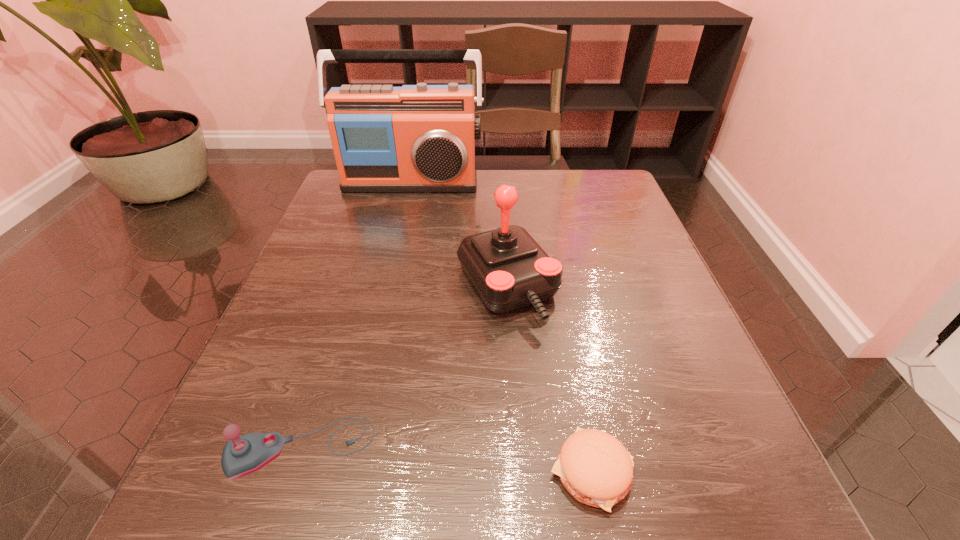
Find the location of a particular element. free space that satisfies the following two spatial constraints: 1. on the front-facing side of the patty; 2. on the right side of the tallest object is located at coordinates (342, 471).

Identify the location of free location that satisfies the following two spatial constraints: 1. on the front-facing side of the shortest object; 2. on the left side of the farthest object. (342, 471).